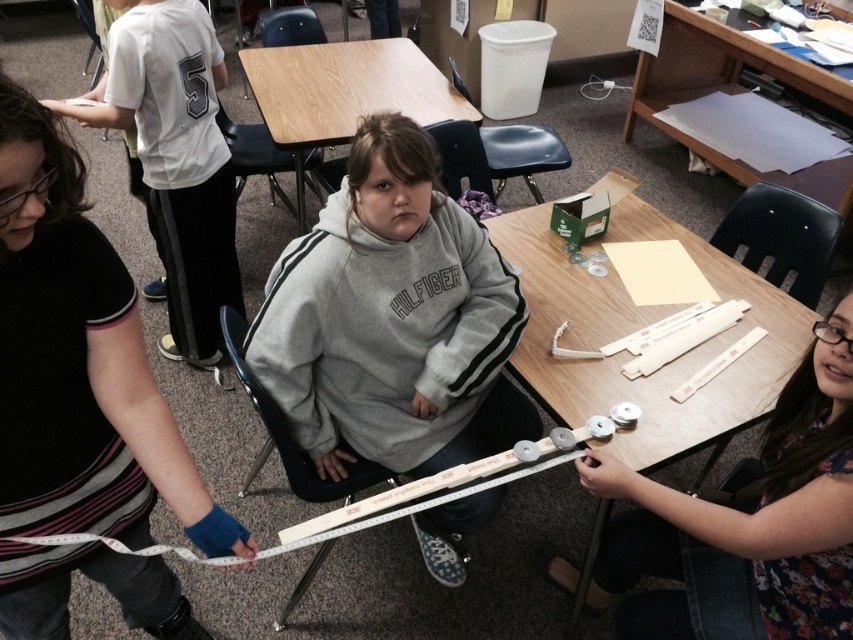
Question: Does gray fleece sweatshirt at center appear under wooden table at center?

Choices:
 (A) yes
 (B) no

Answer: (A)

Question: Which object is positioned farthest from the white plastic ruler at lower right?

Choices:
 (A) wooden table at upper right
 (B) wooden table at center
 (C) white cotton shirt at upper left

Answer: (A)

Question: Can you confirm if white plastic ruler at lower right is smaller than wooden table at center?

Choices:
 (A) yes
 (B) no

Answer: (A)

Question: Based on their relative distances, which object is farther from the white cotton shirt at upper left?

Choices:
 (A) gray fleece sweatshirt at center
 (B) wooden table at upper right

Answer: (B)

Question: Which of the following is the closest to the observer?

Choices:
 (A) (352, 92)
 (B) (635, 488)
 (C) (801, 182)
 (D) (201, 257)

Answer: (B)

Question: Does wooden table at center lie behind wooden table at upper right?

Choices:
 (A) no
 (B) yes

Answer: (A)